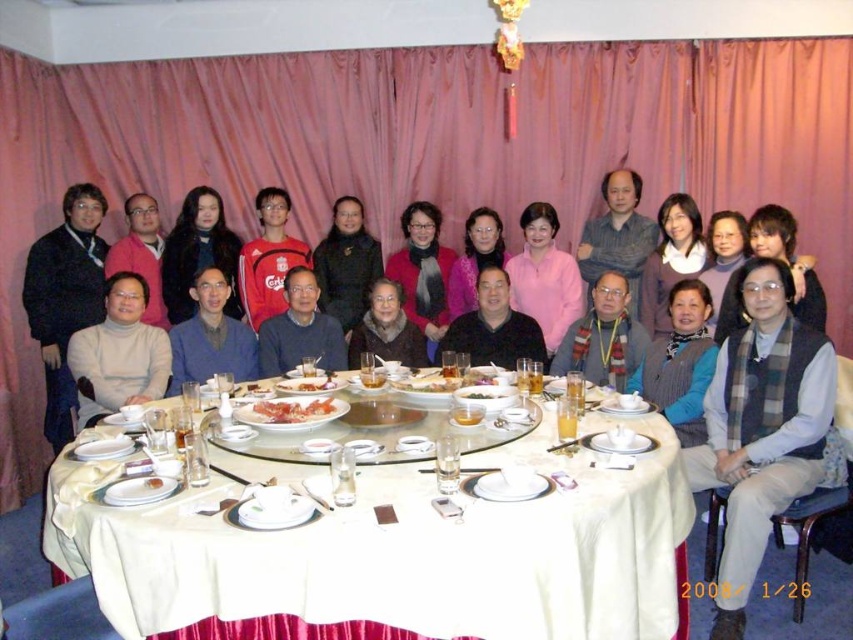
Question: Which point appears closest to the camera in this image?

Choices:
 (A) tap(42, 332)
 (B) tap(837, 154)

Answer: (A)

Question: Is gray wool vest at center closer to camera compared to translucent glass cup at center?

Choices:
 (A) no
 (B) yes

Answer: (B)

Question: Which object is the farthest from the smooth white plate at center?

Choices:
 (A) pink fabric curtain at upper center
 (B) slightly pinkish matte/soft food at center

Answer: (A)

Question: Is pink fabric curtain at upper center thinner than translucent glass cup at center?

Choices:
 (A) no
 (B) yes

Answer: (A)

Question: Based on their relative distances, which object is nearer to the dark gray sweater at center?

Choices:
 (A) matte white sweater at center
 (B) gray sweater at center
 (C) shiny red plate at center

Answer: (B)

Question: Does matte white sweater at center have a larger size compared to dark gray sweater at center?

Choices:
 (A) no
 (B) yes

Answer: (B)